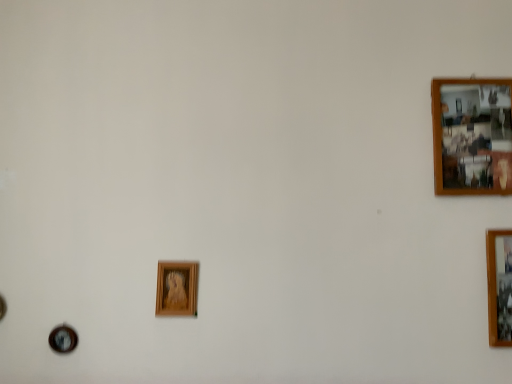
Question: Would you say wooden photo frame at upper right, which appears as the first picture frame when viewed from the top, is to the left or to the right of wooden picture frame at center, the 3th picture frame in the right-to-left sequence, in the picture?

Choices:
 (A) left
 (B) right

Answer: (B)

Question: From the image's perspective, is wooden photo frame at upper right, which appears as the first picture frame when viewed from the top, above or below wooden picture frame at center, the 3th picture frame in the right-to-left sequence?

Choices:
 (A) above
 (B) below

Answer: (A)

Question: Estimate the real-world distances between objects in this image. Which object is farther from the wooden picture frame at center, the 3th picture frame in the right-to-left sequence?

Choices:
 (A) wooden photo frame at upper right, marked as the 3th picture frame in a bottom-to-top arrangement
 (B) wooden photo frame at right, the 1th picture frame when ordered from right to left

Answer: (B)

Question: Based on their relative distances, which object is farther from the wooden photo frame at upper right, which appears as the first picture frame when viewed from the top?

Choices:
 (A) wooden photo frame at right, the 1th picture frame when ordered from right to left
 (B) wooden picture frame at center, the 3th picture frame in the right-to-left sequence

Answer: (B)